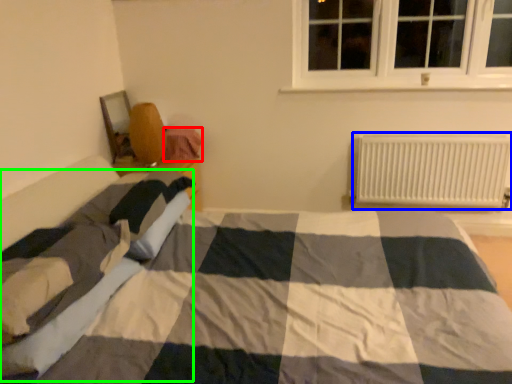
Question: Based on their relative distances, which object is nearer to material (highlighted by a red box)? Choose from radiator (highlighted by a blue box) and blanket (highlighted by a green box).

Choices:
 (A) radiator
 (B) blanket

Answer: (B)